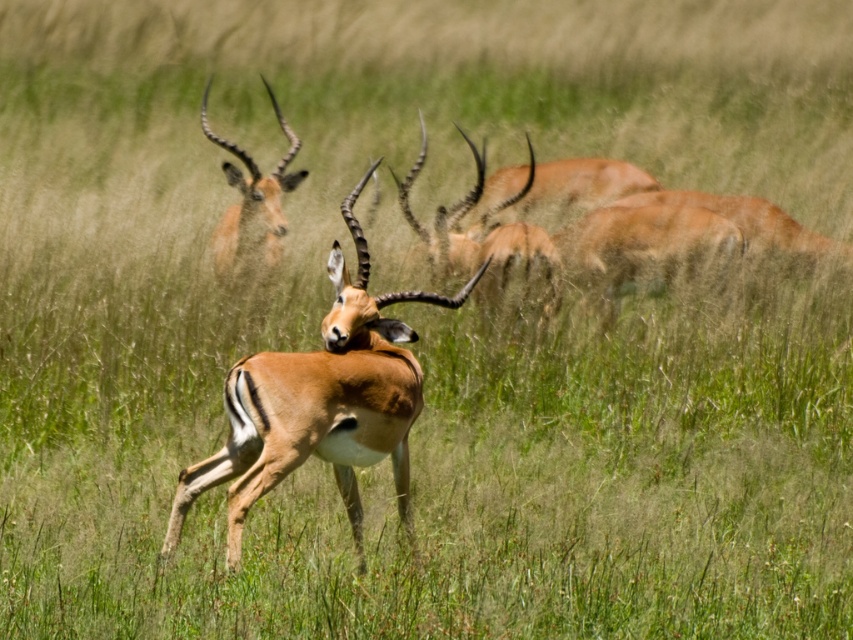
Which is behind, point (341, 388) or point (236, 170)?

The point (236, 170) is behind.

Find the location of a particular element. This screenshot has height=640, width=853. brown glossy antelope at center is located at coordinates (320, 403).

From the picture: Who is more distant from viewer, (341, 284) or (206, 93)?

The point (206, 93) is behind.

Identify the location of brown glossy antelope at center. This screenshot has height=640, width=853. (320, 403).

Who is shorter, brown velvet antelope at center or brown velvet antelope at upper left?

brown velvet antelope at upper left is shorter.

Is brown velvet antelope at center smaller than brown velvet antelope at upper left?

Actually, brown velvet antelope at center might be larger than brown velvet antelope at upper left.

Which is in front, point (436, 216) or point (225, 237)?

Point (436, 216)

At what (x,y) coordinates should I click in order to perform the action: click on brown velvet antelope at center. Please return your answer as a coordinate pair (x, y). The width and height of the screenshot is (853, 640). Looking at the image, I should click on (485, 237).

Is brown glossy antelope at center below brown velvet antelope at center?

Yes, brown glossy antelope at center is below brown velvet antelope at center.

Is brown glossy antelope at center to the right of brown velvet antelope at center from the viewer's perspective?

In fact, brown glossy antelope at center is to the left of brown velvet antelope at center.

At what (x,y) coordinates should I click in order to perform the action: click on brown glossy antelope at center. Please return your answer as a coordinate pair (x, y). This screenshot has width=853, height=640. Looking at the image, I should click on (320, 403).